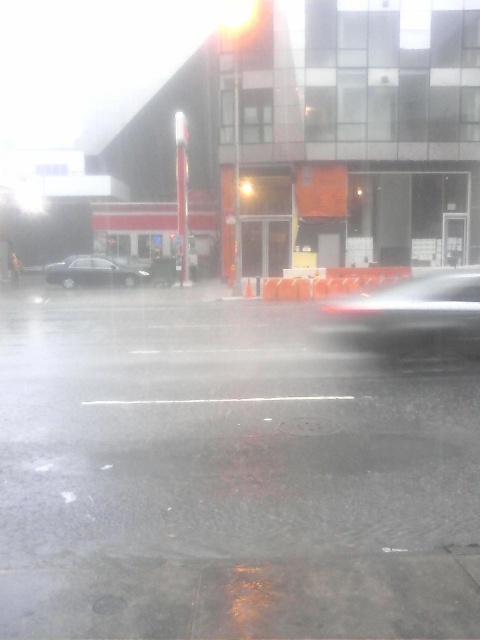
You are a passenger in the vehicle and notice a sedan outside the window. Can you determine if the sedan is positioned closer to the front or the back of the vehicle you are in based on its location at point (93,273)?

The sedan at point (93,273) is positioned closer to the front of the vehicle you are in since the coordinates indicate it is near the center, which is typically aligned with the front area when viewed from inside a car.

Consider the image. You are driving a car that requires a minimum of 15 meters to safely pass between two other vehicles. You see a shiny silver sedan at center and a satin black sedan at center. Can you safely pass between them?

The shiny silver sedan at center and satin black sedan at center are 18.03 meters apart from each other, which is more than the required 15 meters, so you can safely pass between them.

You are a passenger in the shiny silver sedan at center and want to exit the vehicle. The orange plastic barrier at center is blocking the door. Can you open the driver side door without hitting the barrier?

The shiny silver sedan at center is to the right of orange plastic barrier at center, so opening the driver side door may not hit the barrier since the sedan is positioned away from it.